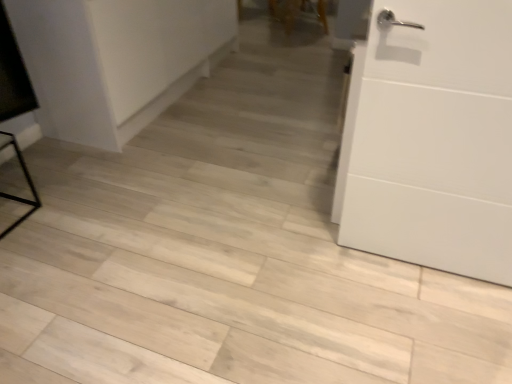
Question: Does white matte door at right appear on the right side of white matte cabinet at upper left?

Choices:
 (A) no
 (B) yes

Answer: (B)

Question: Is white matte door at right bigger than white matte cabinet at upper left?

Choices:
 (A) yes
 (B) no

Answer: (B)

Question: Is white matte door at right outside of white matte cabinet at upper left?

Choices:
 (A) yes
 (B) no

Answer: (A)

Question: From a real-world perspective, is white matte door at right positioned under white matte cabinet at upper left based on gravity?

Choices:
 (A) no
 (B) yes

Answer: (A)

Question: Is white matte door at right taller than white matte cabinet at upper left?

Choices:
 (A) yes
 (B) no

Answer: (A)

Question: Is the position of white matte door at right more distant than that of white matte cabinet at upper left?

Choices:
 (A) yes
 (B) no

Answer: (B)

Question: Is wooden chair at upper center in front of white matte cabinet at upper left?

Choices:
 (A) yes
 (B) no

Answer: (B)

Question: Is white matte cabinet at upper left inside wooden chair at upper center?

Choices:
 (A) yes
 (B) no

Answer: (B)

Question: Would you say wooden chair at upper center is a long distance from white matte cabinet at upper left?

Choices:
 (A) yes
 (B) no

Answer: (A)

Question: From the image's perspective, does wooden chair at upper center appear higher than white matte cabinet at upper left?

Choices:
 (A) no
 (B) yes

Answer: (B)

Question: Is the depth of wooden chair at upper center greater than that of white matte cabinet at upper left?

Choices:
 (A) yes
 (B) no

Answer: (A)

Question: Can you confirm if wooden chair at upper center is shorter than white matte cabinet at upper left?

Choices:
 (A) no
 (B) yes

Answer: (B)

Question: Does white matte door at right have a smaller size compared to wooden chair at upper center?

Choices:
 (A) no
 (B) yes

Answer: (A)